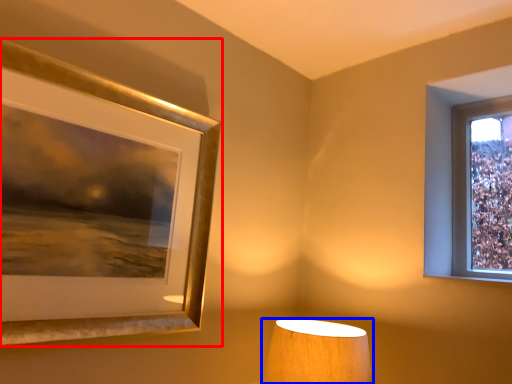
Question: Which object is closer to the camera taking this photo, picture frame (highlighted by a red box) or lamp (highlighted by a blue box)?

Choices:
 (A) picture frame
 (B) lamp

Answer: (A)